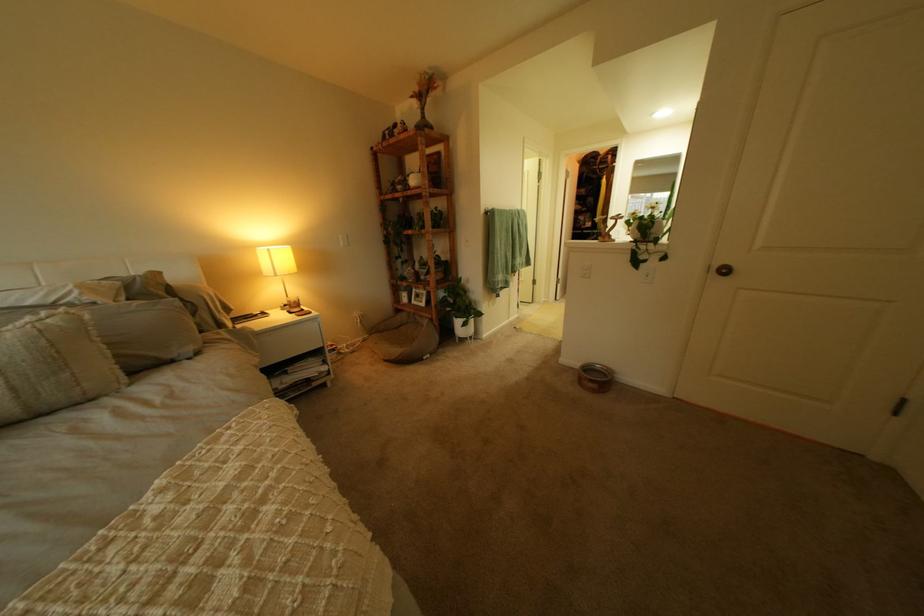
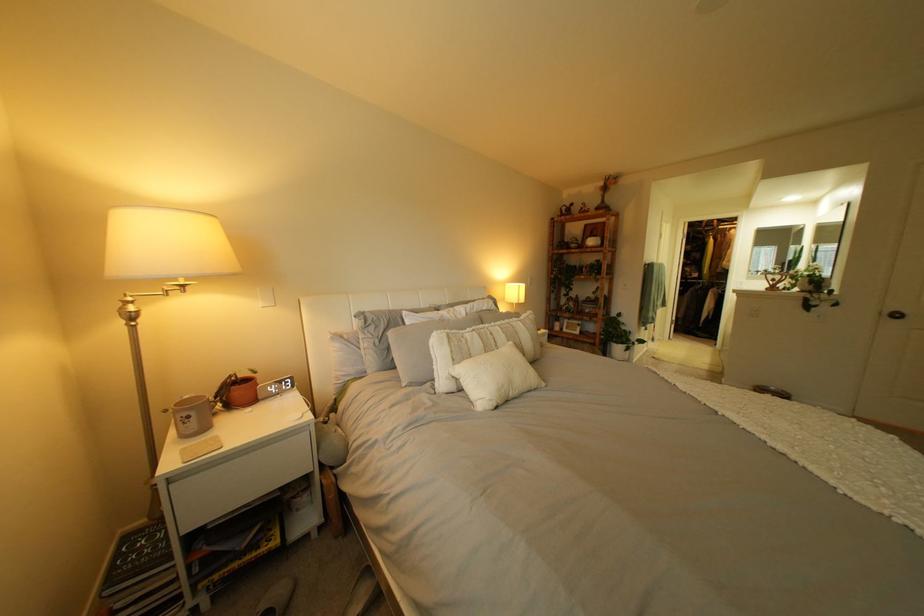
What movement of the cameraman would produce the second image?

The cameraman moved toward left, backward.